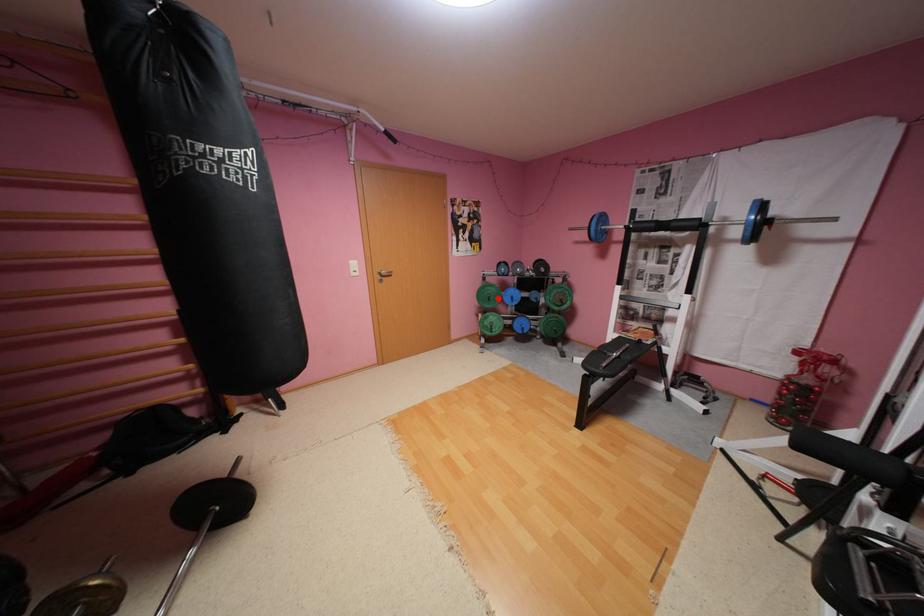
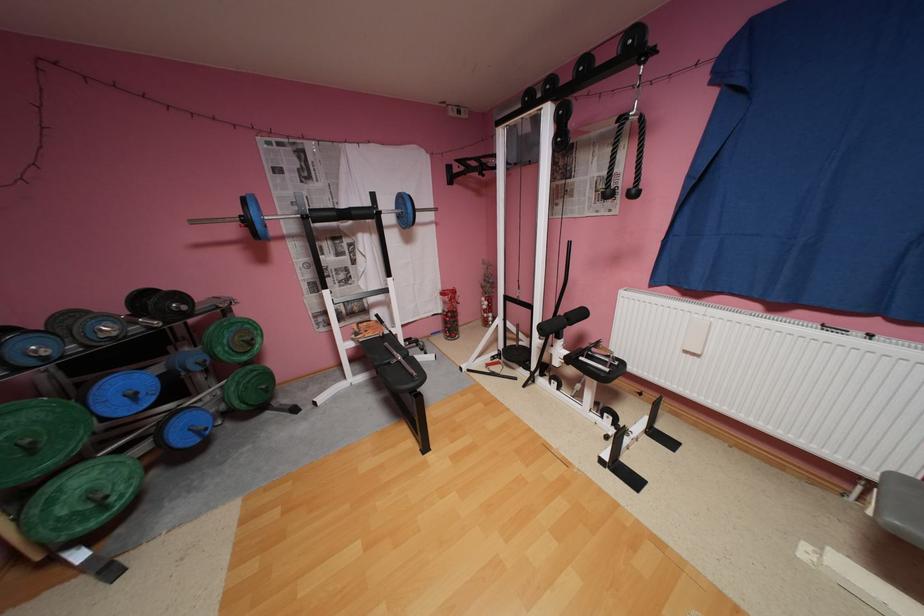
Question: A red point is marked in image1. In image2, is the corresponding 3D point closer to the camera or farther? Reply with the corresponding letter.

Choices:
 (A) The corresponding 3D point is closer.
 (B) The corresponding 3D point is farther.

Answer: (B)